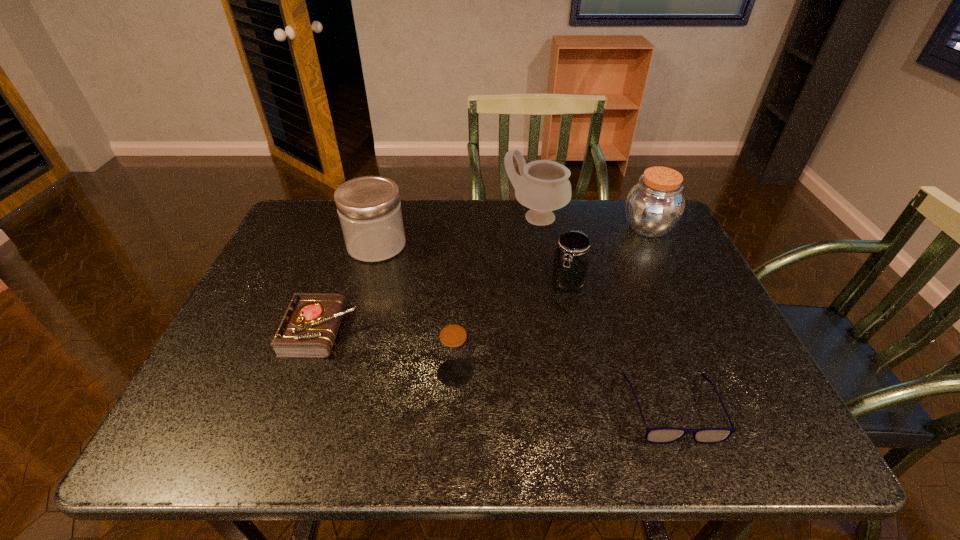
Locate an element on the screen. vacant position located 0.390m on the front of the leftmost jar is located at coordinates (338, 383).

What are the coordinates of `free region located 0.100m on the front of the rightmost jar` in the screenshot? It's located at (666, 267).

Identify the location of free space located on the lid of the third farthest jar. The image size is (960, 540). (588, 373).

Where is `vacant region located 0.090m on the front of the third object from left to right`? vacant region located 0.090m on the front of the third object from left to right is located at coordinates (452, 429).

You are a GUI agent. You are given a task and a screenshot of the screen. Output one action in this format:
    pyautogui.click(x=<x>, y=<y>)
    Task: Click on the free location located on the back of the diary
    
    Given the screenshot: What is the action you would take?
    pyautogui.click(x=338, y=289)

Identify the location of pottery present at the far edge. (543, 186).

Locate an element on the screen. Image resolution: width=960 pixels, height=540 pixels. object that is at the near edge is located at coordinates (659, 435).

At what (x,y) coordinates should I click in order to perform the action: click on object that is at the left edge. Please return your answer as a coordinate pair (x, y). This screenshot has height=540, width=960. Looking at the image, I should click on (309, 327).

You are a GUI agent. You are given a task and a screenshot of the screen. Output one action in this format:
    pyautogui.click(x=<x>, y=<y>)
    Task: Click on the jar situated at the right edge
    The image size is (960, 540).
    Given the screenshot: What is the action you would take?
    pyautogui.click(x=655, y=205)

Where is `spectacles located in the right edge section of the desktop`? spectacles located in the right edge section of the desktop is located at coordinates (659, 435).